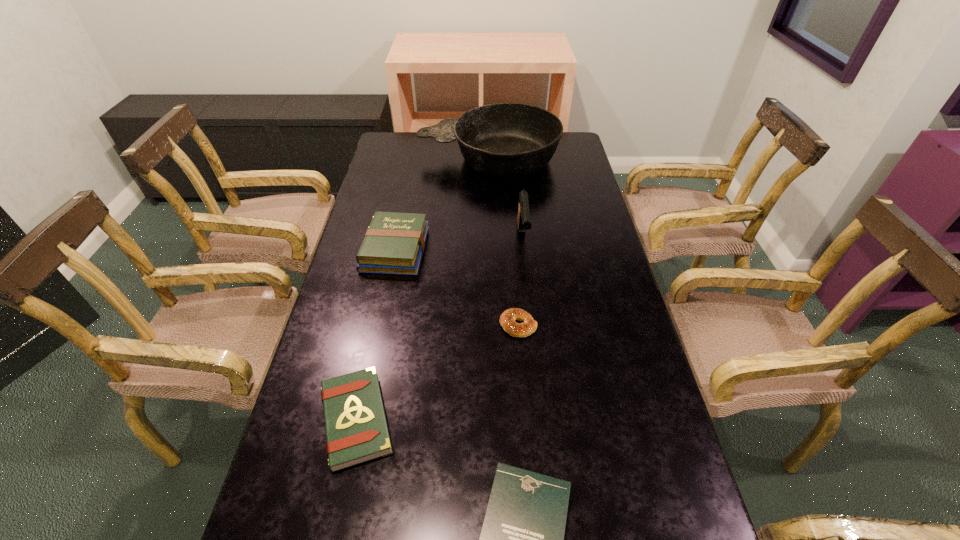
At what (x,y) coordinates should I click in order to perform the action: click on frying pan situated at the left edge. Please return your answer as a coordinate pair (x, y). Image resolution: width=960 pixels, height=540 pixels. Looking at the image, I should click on (504, 140).

Image resolution: width=960 pixels, height=540 pixels. I want to click on object that is at the right edge, so click(x=504, y=140).

Where is `object situated at the far left corner`? The height and width of the screenshot is (540, 960). object situated at the far left corner is located at coordinates (504, 140).

At what (x,y) coordinates should I click in order to perform the action: click on object at the far right corner. Please return your answer as a coordinate pair (x, y). The image size is (960, 540). Looking at the image, I should click on (504, 140).

Locate an element on the screen. free region at the left edge is located at coordinates (316, 353).

What are the coordinates of `vacant position at the right edge of the desktop` in the screenshot? It's located at (551, 199).

In the image, there is a desktop. At what (x,y) coordinates should I click in order to perform the action: click on vacant space at the far left corner. Please return your answer as a coordinate pair (x, y). The image size is (960, 540). Looking at the image, I should click on (392, 133).

Locate an element on the screen. The width and height of the screenshot is (960, 540). free point between the farthest object and the tallest book is located at coordinates (442, 204).

In order to click on free area in between the fourth farthest object and the pistol in this screenshot , I will do `click(520, 281)`.

Locate which object ranks in proximity to the rightmost book. Please provide its 2D coordinates. Your answer should be formatted as a tuple, i.e. [(x, y)], where the tuple contains the x and y coordinates of a point satisfying the conditions above.

[(356, 428)]